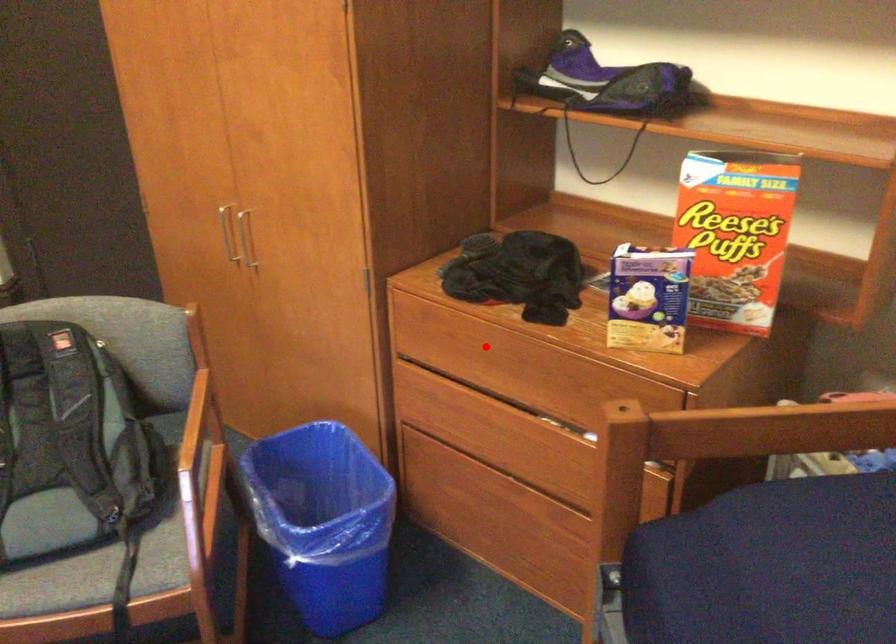
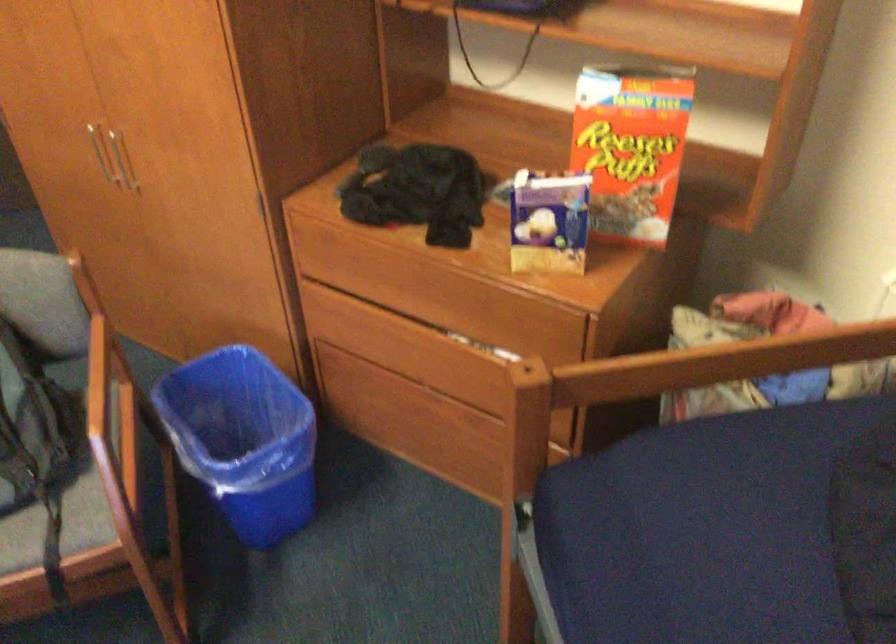
In the second image, find the point that corresponds to the highlighted location in the first image.

(392, 269)